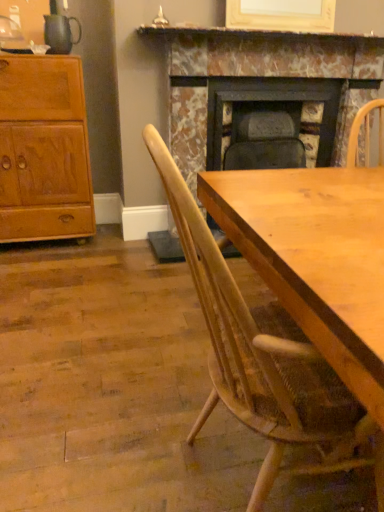
Question: Considering the relative positions of marble fireplace at center and marble fireplace at upper center in the image provided, is marble fireplace at center to the left or to the right of marble fireplace at upper center?

Choices:
 (A) left
 (B) right

Answer: (B)

Question: Is marble fireplace at center taller or shorter than marble fireplace at upper center?

Choices:
 (A) short
 (B) tall

Answer: (B)

Question: Estimate the real-world distances between objects in this image. Which object is closer to the marble fireplace at center?

Choices:
 (A) light brown wood cabinet at left
 (B) marble fireplace at upper center
 (C) light wood chair at center

Answer: (B)

Question: Based on their relative distances, which object is farther from the light wood chair at center?

Choices:
 (A) light brown wood cabinet at left
 (B) marble fireplace at center
 (C) marble fireplace at upper center

Answer: (C)